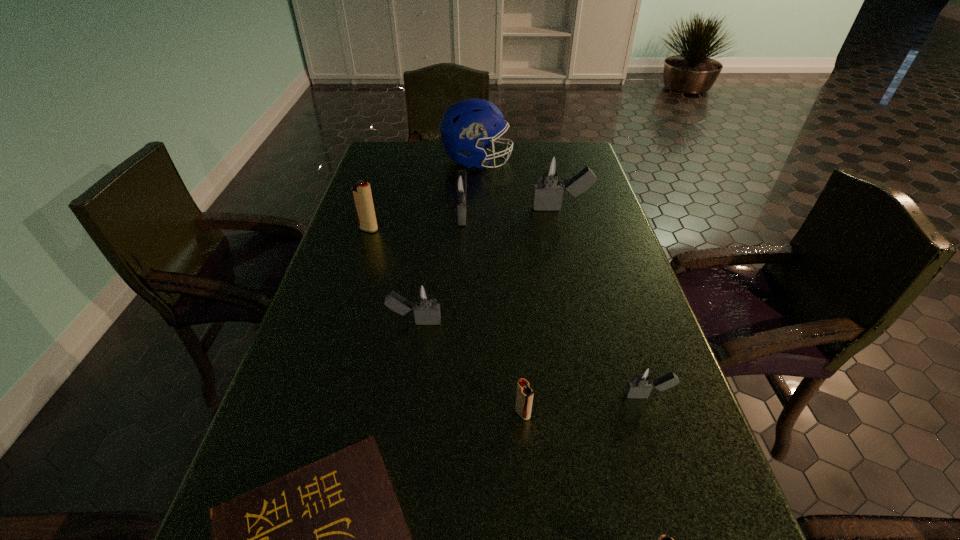
Locate an element on the screen. free space between the second red igniter from left to right and the farthest object is located at coordinates pyautogui.click(x=500, y=287).

In order to click on empty space that is in between the biggest red igniter and the second biggest gray igniter in this screenshot , I will do `click(416, 221)`.

Find the location of `free space between the second red igniter from right to left and the tallest igniter`. free space between the second red igniter from right to left and the tallest igniter is located at coordinates (542, 311).

Identify which object is the fifth closest to the biggest red igniter. Please provide its 2D coordinates. Your answer should be formatted as a tuple, i.e. [(x, y)], where the tuple contains the x and y coordinates of a point satisfying the conditions above.

[(329, 539)]

This screenshot has width=960, height=540. What are the coordinates of `object that ranks as the eighth closest to the fourth farthest igniter` in the screenshot? It's located at 465,126.

Select which igniter appears as the fifth closest to the hardback book. Please provide its 2D coordinates. Your answer should be formatted as a tuple, i.e. [(x, y)], where the tuple contains the x and y coordinates of a point satisfying the conditions above.

[(361, 193)]

Choose which igniter is the third nearest neighbor to the nearest gray igniter. Please provide its 2D coordinates. Your answer should be formatted as a tuple, i.e. [(x, y)], where the tuple contains the x and y coordinates of a point satisfying the conditions above.

[(424, 301)]

Identify which gray igniter is the third nearest to the farthest object. Please provide its 2D coordinates. Your answer should be formatted as a tuple, i.e. [(x, y)], where the tuple contains the x and y coordinates of a point satisfying the conditions above.

[(424, 301)]

The height and width of the screenshot is (540, 960). In order to click on the third closest gray igniter to the second biggest gray igniter in this screenshot , I will do `click(643, 379)`.

Locate an element on the screen. The image size is (960, 540). red igniter that is the nearest to the fourth igniter from left to right is located at coordinates (663, 539).